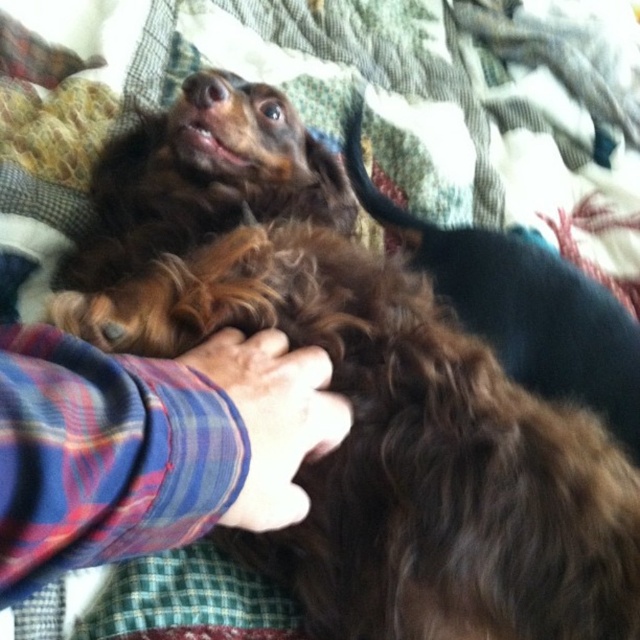
Question: Can you confirm if plaid fabric hand at center is positioned below brown curly fur at center?

Choices:
 (A) yes
 (B) no

Answer: (A)

Question: Does plaid fabric hand at center appear on the right side of brown curly fur at center?

Choices:
 (A) no
 (B) yes

Answer: (A)

Question: Among these objects, which one is farthest from the camera?

Choices:
 (A) plaid fabric hand at center
 (B) brown curly fur at center

Answer: (B)

Question: Which of the following is the farthest from the observer?

Choices:
 (A) brown curly fur at center
 (B) brown curly fur paw at center

Answer: (A)

Question: Which of the following is the farthest from the observer?

Choices:
 (A) (310, 456)
 (B) (224, 390)

Answer: (A)

Question: Is plaid fabric hand at center smaller than brown curly fur at center?

Choices:
 (A) no
 (B) yes

Answer: (B)